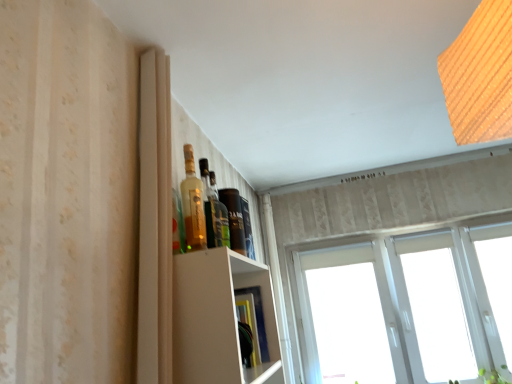
Question: Should I look upward or downward to see green leafy plant at lower right?

Choices:
 (A) up
 (B) down

Answer: (B)

Question: Is white plastic window at upper right thinner than wooden textured light at upper right?

Choices:
 (A) no
 (B) yes

Answer: (B)

Question: From a real-world perspective, does white plastic window at upper right sit lower than wooden textured light at upper right?

Choices:
 (A) yes
 (B) no

Answer: (A)

Question: Is white plastic window at upper right in front of wooden textured light at upper right?

Choices:
 (A) no
 (B) yes

Answer: (A)

Question: Is white plastic window at upper right at the left side of wooden textured light at upper right?

Choices:
 (A) yes
 (B) no

Answer: (B)

Question: Is white plastic window at upper right completely or partially outside of wooden textured light at upper right?

Choices:
 (A) no
 (B) yes

Answer: (B)

Question: Can you confirm if white plastic window at upper right is positioned to the right of wooden textured light at upper right?

Choices:
 (A) no
 (B) yes

Answer: (B)

Question: From a real-world perspective, does green leafy plant at lower right stand above translucent glass bottle at upper center, arranged as the second bottle when viewed from the front?

Choices:
 (A) yes
 (B) no

Answer: (B)

Question: Is green leafy plant at lower right to the right of translucent glass bottle at upper center, which is the first bottle from back to front, from the viewer's perspective?

Choices:
 (A) yes
 (B) no

Answer: (A)

Question: From the image's perspective, is green leafy plant at lower right located beneath translucent glass bottle at upper center, arranged as the second bottle when viewed from the front?

Choices:
 (A) no
 (B) yes

Answer: (B)

Question: Is green leafy plant at lower right to the left of translucent glass bottle at upper center, arranged as the second bottle when viewed from the front, from the viewer's perspective?

Choices:
 (A) yes
 (B) no

Answer: (B)

Question: From the image's perspective, does green leafy plant at lower right appear higher than translucent glass bottle at upper center, arranged as the second bottle when viewed from the front?

Choices:
 (A) yes
 (B) no

Answer: (B)

Question: Is translucent glass bottle at upper center, arranged as the second bottle when viewed from the front, inside green leafy plant at lower right?

Choices:
 (A) no
 (B) yes

Answer: (A)

Question: Does wooden textured light at upper right have a larger size compared to white plastic window at upper right?

Choices:
 (A) no
 (B) yes

Answer: (A)